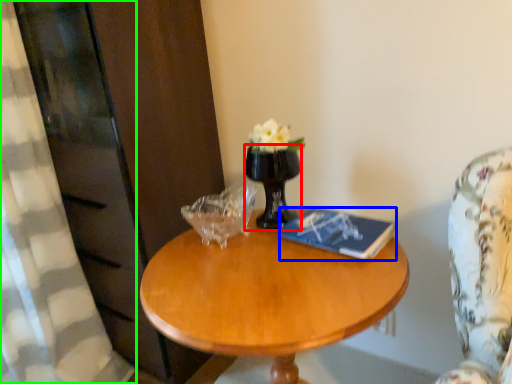
Question: Which object is the closest to the vase (highlighted by a red box)? Choose among these: book (highlighted by a blue box) or curtain (highlighted by a green box).

Choices:
 (A) book
 (B) curtain

Answer: (A)